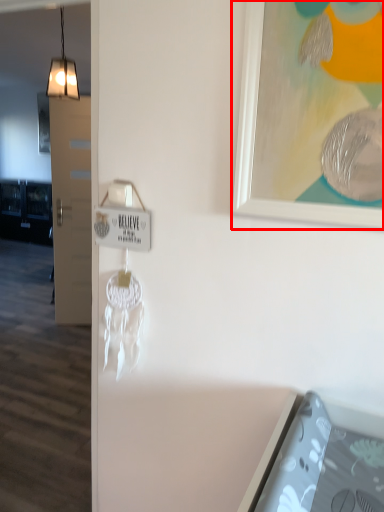
Question: From the image's perspective, where is picture frame (annotated by the red box) located relative to light?

Choices:
 (A) above
 (B) below

Answer: (B)